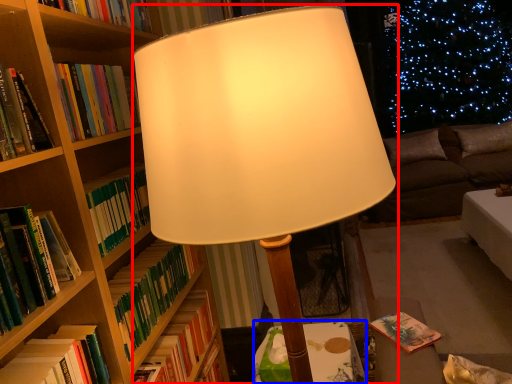
Question: Which point is further to the camera, lamp (highlighted by a red box) or table (highlighted by a blue box)?

Choices:
 (A) lamp
 (B) table

Answer: (B)